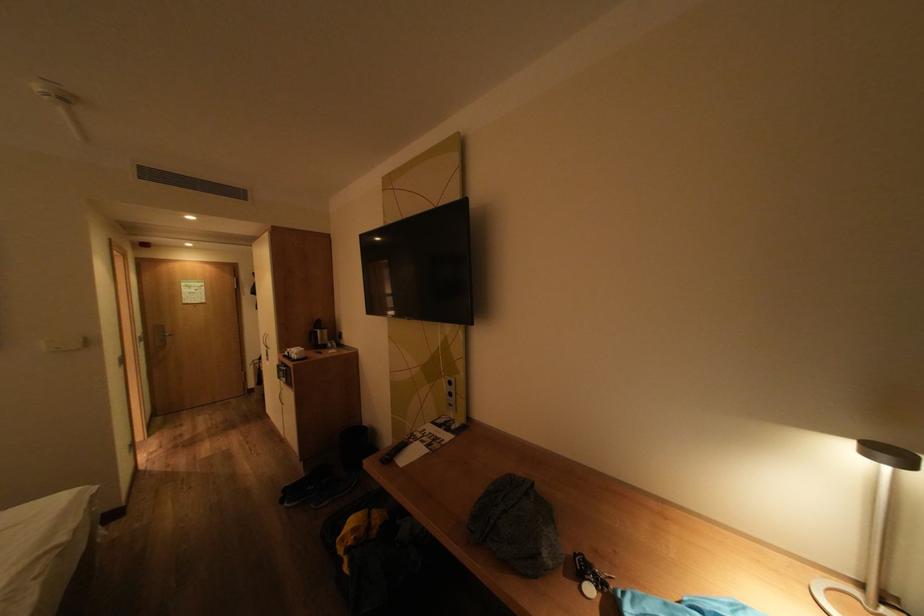
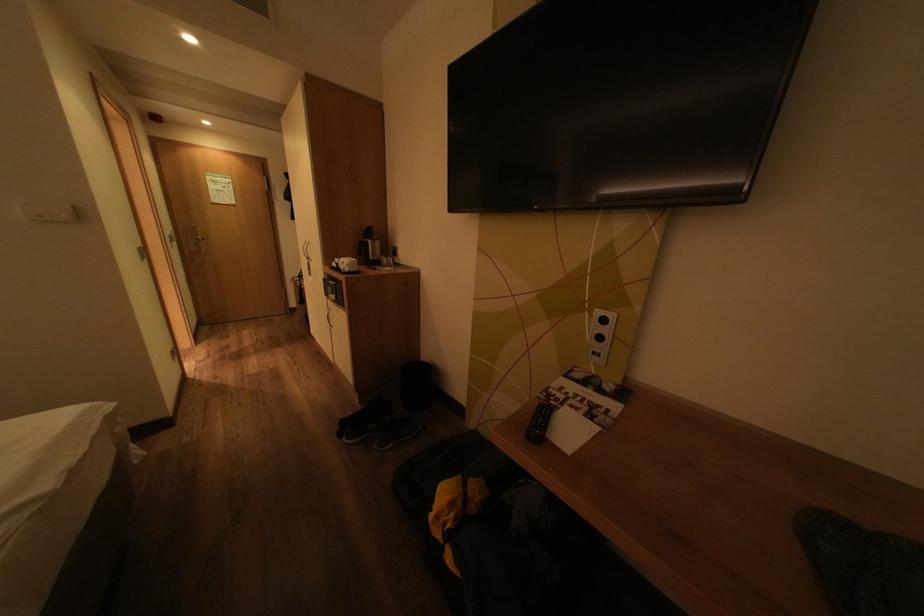
Question: The images are taken continuously from a first-person perspective. In which direction is your viewpoint rotating?

Choices:
 (A) Left
 (B) Right
 (C) Up
 (D) Down

Answer: (D)